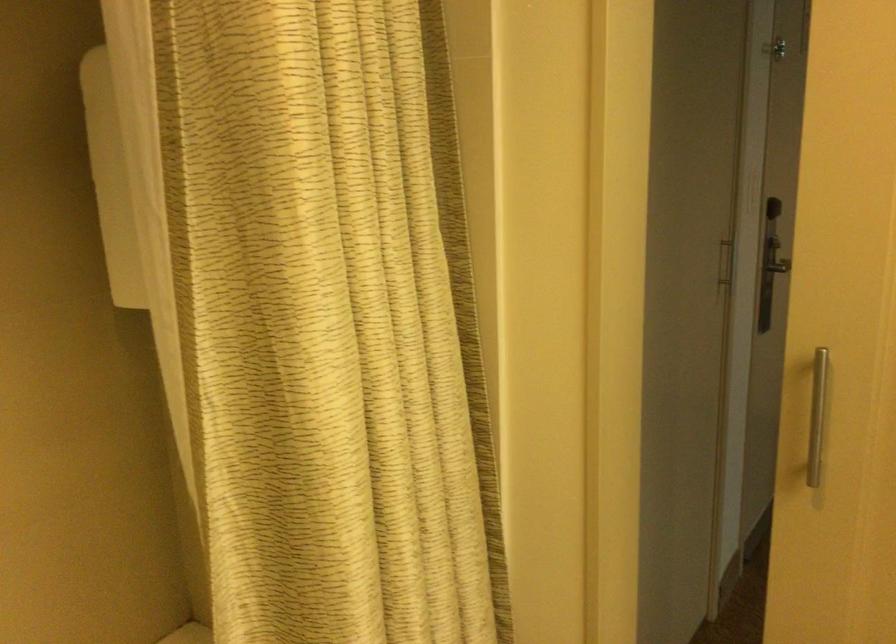
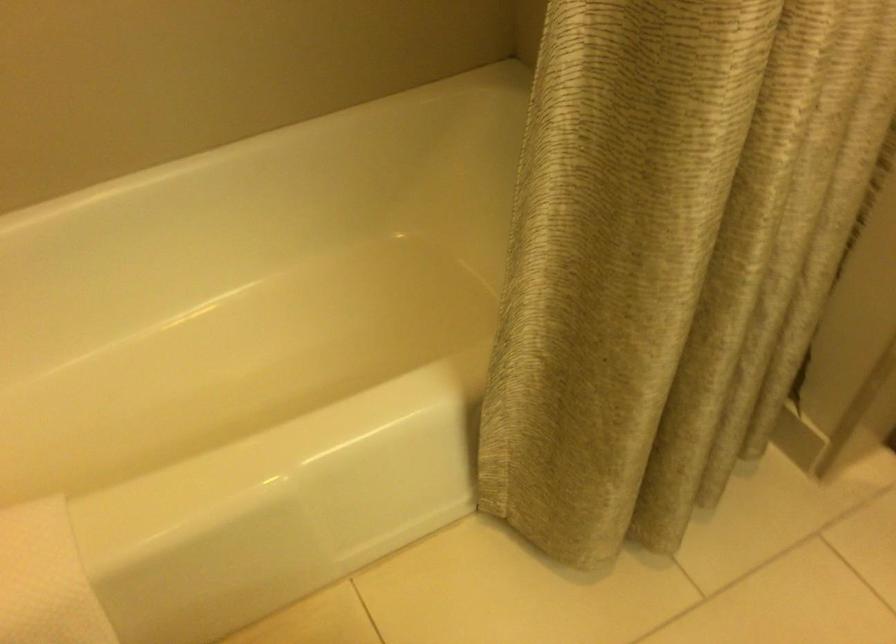
How did the camera likely rotate?

The camera's rotation is toward left-down.